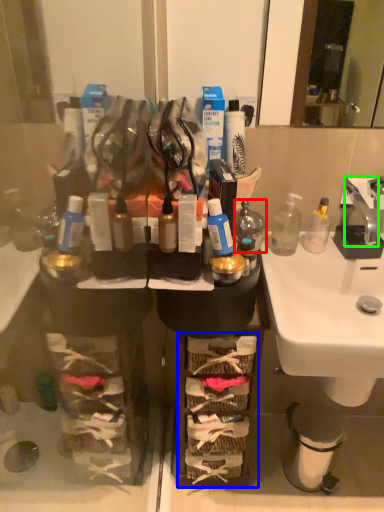
Question: Which object is positioned farthest from bottle (highlighted by a red box)? Select from shelf (highlighted by a blue box) and faucet (highlighted by a green box).

Choices:
 (A) shelf
 (B) faucet

Answer: (A)